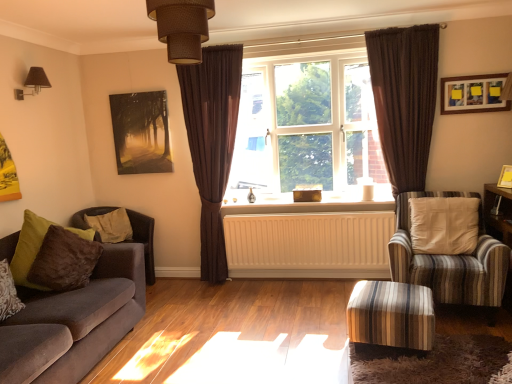
How much space does brown woven lampshade at upper center, marked as the first light fixture in a front-to-back arrangement, occupy horizontally?

brown woven lampshade at upper center, marked as the first light fixture in a front-to-back arrangement, is 13.19 inches wide.

The image size is (512, 384). Describe the element at coordinates (473, 94) in the screenshot. I see `wooden framed picture at upper right, which is the 2th picture frame in front-to-back order` at that location.

Describe the element at coordinates (144, 240) in the screenshot. I see `velvet brown armchair at left, which appears as the 2th chair when viewed from the front` at that location.

What do you see at coordinates (450, 261) in the screenshot? This screenshot has height=384, width=512. I see `striped fabric armchair at right, acting as the 1th chair starting from the right` at bounding box center [450, 261].

The height and width of the screenshot is (384, 512). Identify the location of brown woven lampshade at upper center, acting as the second light fixture starting from the back. (182, 27).

Is velvet brown pillow at lower left, the first pillow positioned from the front, not within striped fabric ottoman at lower right?

Yes, velvet brown pillow at lower left, the first pillow positioned from the front, is located beyond the bounds of striped fabric ottoman at lower right.

There is a striped fabric ottoman at lower right. At what (x,y) coordinates should I click in order to perform the action: click on the 1st pillow above it (from the image's perspective). Please return your answer as a coordinate pair (x, y). The width and height of the screenshot is (512, 384). Looking at the image, I should click on (8, 293).

Is point (13, 303) positioned in front of point (371, 317)?

No.

Does velvet brown pillow at lower left, which is the second pillow from back to front, have a lesser width compared to striped fabric ottoman at lower right?

Yes.

Does white matte radiator at center have a smaller size compared to brown woven lampshade at upper center, which ranks as the first light fixture in right-to-left order?

No, white matte radiator at center is not smaller than brown woven lampshade at upper center, which ranks as the first light fixture in right-to-left order.

Considering the relative sizes of white matte radiator at center and brown woven lampshade at upper center, which ranks as the first light fixture in right-to-left order, in the image provided, is white matte radiator at center wider than brown woven lampshade at upper center, which ranks as the first light fixture in right-to-left order,?

No, white matte radiator at center is not wider than brown woven lampshade at upper center, which ranks as the first light fixture in right-to-left order.

Who is taller, white matte radiator at center or brown woven lampshade at upper center, acting as the second light fixture starting from the back?

With more height is white matte radiator at center.

What's the angular difference between white matte radiator at center and brown woven lampshade at upper center, which ranks as the first light fixture in right-to-left order,'s facing directions?

There is a 1.72-degree angle between the facing directions of white matte radiator at center and brown woven lampshade at upper center, which ranks as the first light fixture in right-to-left order.

Consider the image. Is wooden picture frame at upper right, the third picture frame when ordered from left to right, inside or outside of matte black painting at upper left, which is the 3th picture frame in front-to-back order?

wooden picture frame at upper right, the third picture frame when ordered from left to right, is not inside matte black painting at upper left, which is the 3th picture frame in front-to-back order, it's outside.

Is point (506, 172) positioned in front of point (143, 102)?

Yes, point (506, 172) is closer to viewer.

From a real-world perspective, who is located lower, wooden picture frame at upper right, which is counted as the first picture frame, starting from the front, or matte black painting at upper left, arranged as the 3th picture frame when viewed from the right?

wooden picture frame at upper right, which is counted as the first picture frame, starting from the front.

Could you tell me if wooden picture frame at upper right, arranged as the third picture frame when viewed from the back, is turned towards matte black painting at upper left, which is the 3th picture frame in front-to-back order?

No.

Locate an element on the screen. This screenshot has height=384, width=512. radiator on the right of brown fabric lampshade at upper left, acting as the first light fixture starting from the left is located at coordinates (309, 244).

Can you confirm if brown fabric lampshade at upper left, which appears as the 2th light fixture when viewed from the front, is bigger than white matte radiator at center?

Incorrect, brown fabric lampshade at upper left, which appears as the 2th light fixture when viewed from the front, is not larger than white matte radiator at center.

From a real-world perspective, which is physically below, brown fabric lampshade at upper left, the 2th light fixture from the right, or white matte radiator at center?

white matte radiator at center is physically lower.

Is the position of brown fabric lampshade at upper left, placed as the 1th light fixture when sorted from back to front, less distant than that of white matte radiator at center?

Yes, it is.

What are the coordinates of `pillow that appears above the velvet brown pillow at lower left, which is the second pillow from back to front (from a real-world perspective)` in the screenshot? It's located at (111, 225).

From a real-world perspective, is brown plush pillow at left, marked as the 2th pillow in a front-to-back arrangement, on velvet brown pillow at lower left, which is the second pillow from back to front?

Yes.

What's the angular difference between brown plush pillow at left, marked as the 2th pillow in a front-to-back arrangement, and velvet brown pillow at lower left, the first pillow positioned from the front,'s facing directions?

brown plush pillow at left, marked as the 2th pillow in a front-to-back arrangement, and velvet brown pillow at lower left, the first pillow positioned from the front, are facing 20.5 degrees away from each other.

Is brown plush pillow at left, marked as the 2th pillow in a front-to-back arrangement, in contact with velvet brown pillow at lower left, the first pillow positioned from the front?

No, brown plush pillow at left, marked as the 2th pillow in a front-to-back arrangement, is not next to velvet brown pillow at lower left, the first pillow positioned from the front.

Is wooden framed picture at upper right, which is the 2th picture frame in front-to-back order, further to camera compared to brown fabric lampshade at upper left, placed as the 1th light fixture when sorted from back to front?

Yes, wooden framed picture at upper right, which is the 2th picture frame in front-to-back order, is behind brown fabric lampshade at upper left, placed as the 1th light fixture when sorted from back to front.

From the picture: Is wooden framed picture at upper right, the 2th picture frame in the right-to-left sequence, in contact with brown fabric lampshade at upper left, acting as the first light fixture starting from the left?

No, wooden framed picture at upper right, the 2th picture frame in the right-to-left sequence, is not making contact with brown fabric lampshade at upper left, acting as the first light fixture starting from the left.

Considering the positions of points (449, 92) and (16, 90), is point (449, 92) farther from camera compared to point (16, 90)?

Yes.

From a real-world perspective, is wooden framed picture at upper right, the 2th picture frame in the right-to-left sequence, below brown fabric lampshade at upper left, placed as the 1th light fixture when sorted from back to front?

Correct, in the physical world, wooden framed picture at upper right, the 2th picture frame in the right-to-left sequence, is lower than brown fabric lampshade at upper left, placed as the 1th light fixture when sorted from back to front.

Is striped fabric armchair at right, acting as the 1th chair starting from the right, located outside white painted wood at center?

Yes, striped fabric armchair at right, acting as the 1th chair starting from the right, is located beyond the bounds of white painted wood at center.

Is striped fabric armchair at right, which is counted as the first chair, starting from the front, behind white painted wood at center?

No, the depth of striped fabric armchair at right, which is counted as the first chair, starting from the front, is less than that of white painted wood at center.

Identify the location of window sill on the left of striped fabric armchair at right, which is counted as the first chair, starting from the front. (309, 202).

Where is `stool lying behind the velvet brown pillow at lower left, which is the second pillow from back to front`? The image size is (512, 384). stool lying behind the velvet brown pillow at lower left, which is the second pillow from back to front is located at coordinates (391, 315).

Identify the location of radiator that is below the brown woven lampshade at upper center, acting as the second light fixture starting from the back (from the image's perspective). (309, 244).

Considering their positions, is white matte radiator at center positioned closer to clear glass window at center than brown fabric lampshade at upper left, which appears as the 2th light fixture when viewed from the front?

white matte radiator at center is positioned closer to the anchor clear glass window at center.

Which object lies further to the anchor point velvet brown armchair at left, the 1th chair from the back, wooden picture frame at upper right, the first picture frame positioned from the right, or velvet brown pillow at lower left, which is the second pillow from back to front?

wooden picture frame at upper right, the first picture frame positioned from the right, is positioned further to the anchor velvet brown armchair at left, the 1th chair from the back.

Considering their positions, is brown textured curtain at right, marked as the first curtain in a right-to-left arrangement, positioned further to brown woven lampshade at upper center, which ranks as the first light fixture in right-to-left order, than striped fabric ottoman at lower right?

brown textured curtain at right, marked as the first curtain in a right-to-left arrangement, lies further to brown woven lampshade at upper center, which ranks as the first light fixture in right-to-left order, than the other object.

Estimate the real-world distances between objects in this image. Which object is further from matte black painting at upper left, which is the 3th picture frame in front-to-back order, striped fabric armchair at right, acting as the second chair starting from the back, or white painted wood at center?

Among the two, striped fabric armchair at right, acting as the second chair starting from the back, is located further to matte black painting at upper left, which is the 3th picture frame in front-to-back order.

Based on the photo, estimate the real-world distances between objects in this image. Which object is further from velvet brown pillow at lower left, which is the second pillow from back to front, velvet brown armchair at left, which appears as the 2th chair when viewed from the front, or brown sheer curtain at center, which appears as the 1th curtain when viewed from the left?

brown sheer curtain at center, which appears as the 1th curtain when viewed from the left, is further to velvet brown pillow at lower left, which is the second pillow from back to front.

Which object lies further to the anchor point clear glass window at center, velvet brown armchair at left, which appears as the 2th chair when viewed from the front, or matte black painting at upper left, which is the 3th picture frame in front-to-back order?

velvet brown armchair at left, which appears as the 2th chair when viewed from the front, is further to clear glass window at center.

Estimate the real-world distances between objects in this image. Which object is further from brown plush pillow at left, the first pillow viewed from the back, wooden framed picture at upper right, which ranks as the second picture frame in left-to-right order, or brown fabric lampshade at upper left, acting as the first light fixture starting from the left?

wooden framed picture at upper right, which ranks as the second picture frame in left-to-right order, is positioned further to the anchor brown plush pillow at left, the first pillow viewed from the back.

Estimate the real-world distances between objects in this image. Which object is further from matte black painting at upper left, the 1th picture frame in the left-to-right sequence, brown plush pillow at left, the first pillow viewed from the back, or striped fabric ottoman at lower right?

Among the two, striped fabric ottoman at lower right is located further to matte black painting at upper left, the 1th picture frame in the left-to-right sequence.

Locate an element on the screen. The height and width of the screenshot is (384, 512). pillow between velvet brown pillow at lower left, which is the second pillow from back to front, and wooden framed picture at upper right, the 2th picture frame in the right-to-left sequence, from left to right is located at coordinates (111, 225).

I want to click on light fixture between brown fabric lampshade at upper left, the 2th light fixture from the right, and velvet brown pillow at lower left, which is the second pillow from back to front, vertically, so click(x=182, y=27).

Locate an element on the screen. window sill between brown sheer curtain at center, which appears as the 1th curtain when viewed from the left, and brown textured curtain at right, marked as the first curtain in a right-to-left arrangement, from left to right is located at coordinates (309, 202).

The image size is (512, 384). Identify the location of light fixture located between brown fabric lampshade at upper left, acting as the first light fixture starting from the left, and white painted wood at center in the left-right direction. (182, 27).